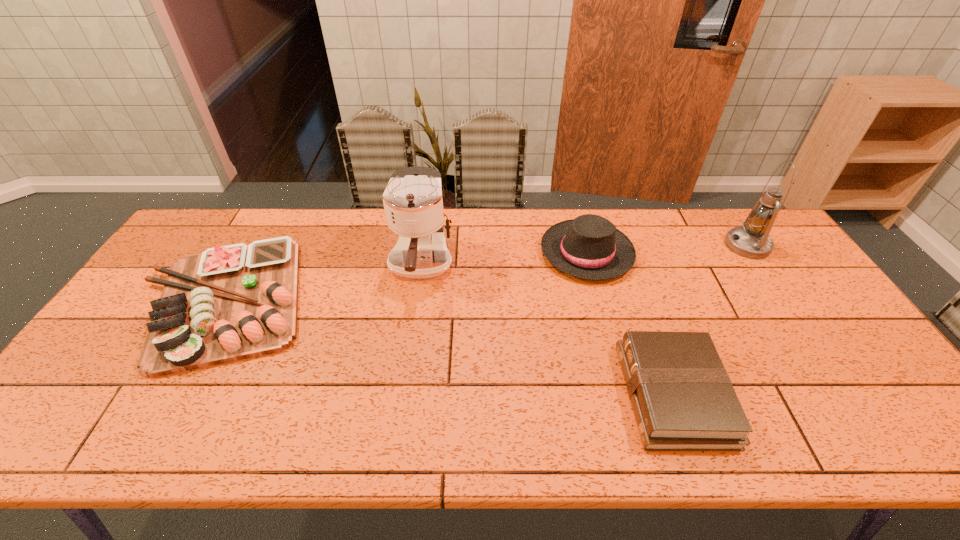
Locate an element on the screen. oil lamp is located at coordinates (751, 240).

Where is `the second object from left to right`? the second object from left to right is located at coordinates (413, 203).

At what (x,y) coordinates should I click in order to perform the action: click on the third shortest object. Please return your answer as a coordinate pair (x, y). This screenshot has width=960, height=540. Looking at the image, I should click on (589, 247).

You are a GUI agent. You are given a task and a screenshot of the screen. Output one action in this format:
    pyautogui.click(x=<x>, y=<y>)
    Task: Click on the leftmost object
    This screenshot has width=960, height=540.
    Given the screenshot: What is the action you would take?
    click(x=228, y=303)

You are a GUI agent. You are given a task and a screenshot of the screen. Output one action in this format:
    pyautogui.click(x=<x>, y=<y>)
    Task: Click on the Bible
    The width and height of the screenshot is (960, 540).
    Given the screenshot: What is the action you would take?
    pyautogui.click(x=683, y=399)

You are a GUI agent. You are given a task and a screenshot of the screen. Output one action in this format:
    pyautogui.click(x=<x>, y=<y>)
    Task: Click on the vacant area situated 0.090m on the left of the oil lamp
    The image size is (960, 540).
    Given the screenshot: What is the action you would take?
    pyautogui.click(x=699, y=246)

Where is `vacant space situated 0.290m on the front-facing side of the second object from left to right`? This screenshot has height=540, width=960. vacant space situated 0.290m on the front-facing side of the second object from left to right is located at coordinates (403, 394).

You are a GUI agent. You are given a task and a screenshot of the screen. Output one action in this format:
    pyautogui.click(x=<x>, y=<y>)
    Task: Click on the free space located 0.320m on the front of the third tallest object
    
    Given the screenshot: What is the action you would take?
    pyautogui.click(x=620, y=377)

Where is `free location located 0.270m on the right of the leftmost object`? The width and height of the screenshot is (960, 540). free location located 0.270m on the right of the leftmost object is located at coordinates (405, 300).

At what (x,y) coordinates should I click in order to perform the action: click on free space located on the spine side of the Bible. Please return your answer as a coordinate pair (x, y). Looking at the image, I should click on (492, 394).